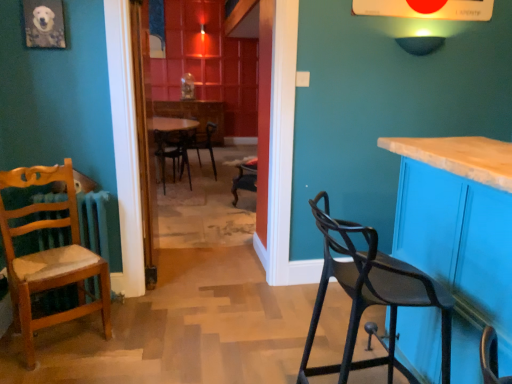
What is the approximate width of wooden table at center?

wooden table at center is 15.55 inches wide.

The height and width of the screenshot is (384, 512). In order to click on wooden table at center in this screenshot , I will do `click(196, 116)`.

The width and height of the screenshot is (512, 384). Find the location of `metallic black chair at center, the 2th chair from the right`. metallic black chair at center, the 2th chair from the right is located at coordinates (203, 144).

Describe the element at coordinates (460, 235) in the screenshot. The height and width of the screenshot is (384, 512). I see `matte wood cabinet at right` at that location.

This screenshot has height=384, width=512. Find the location of `wooden chair with cushion at left, positioned as the second chair in front-to-back order`. wooden chair with cushion at left, positioned as the second chair in front-to-back order is located at coordinates (50, 256).

You are a GUI agent. You are given a task and a screenshot of the screen. Output one action in this format:
    pyautogui.click(x=<x>, y=<y>)
    Task: Click on the black matte bar stool at right, the fourth chair positioned from the left
    Image resolution: width=512 pixels, height=384 pixels.
    Given the screenshot: What is the action you would take?
    coord(371,293)

Can you confirm if wooden radiator at left is bigger than metallic black chair at center, which is counted as the third chair, starting from the left?

Actually, wooden radiator at left might be smaller than metallic black chair at center, which is counted as the third chair, starting from the left.

Is wooden radiator at left to the right of metallic black chair at center, acting as the 4th chair starting from the front, from the viewer's perspective?

No, wooden radiator at left is not to the right of metallic black chair at center, acting as the 4th chair starting from the front.

In the scene shown: Is wooden radiator at left spatially inside metallic black chair at center, which is counted as the third chair, starting from the left, or outside of it?

wooden radiator at left is not enclosed by metallic black chair at center, which is counted as the third chair, starting from the left.

Locate an element on the screen. radiator on the left of metallic black chair at center, the 2th chair from the right is located at coordinates [x=94, y=222].

Choose the correct answer: Is wooden chair with cushion at left, positioned as the fourth chair in right-to-left order, inside metallic black chair at center, the first chair in the back-to-front sequence, or outside it?

The correct answer is: outside.

Image resolution: width=512 pixels, height=384 pixels. I want to click on the 2nd chair positioned below the metallic black chair at center, the first chair in the back-to-front sequence (from the image's perspective), so click(x=50, y=256).

From a real-world perspective, does wooden chair with cushion at left, positioned as the fourth chair in right-to-left order, stand above metallic black chair at center, the first chair in the back-to-front sequence?

Indeed, from a real-world perspective, wooden chair with cushion at left, positioned as the fourth chair in right-to-left order, stands above metallic black chair at center, the first chair in the back-to-front sequence.

Based on the photo, could you tell me if wooden chair with cushion at left, positioned as the fourth chair in right-to-left order, is turned towards metallic black chair at center, the first chair in the back-to-front sequence?

No, wooden chair with cushion at left, positioned as the fourth chair in right-to-left order, is not turned towards metallic black chair at center, the first chair in the back-to-front sequence.

From a real-world perspective, between wooden radiator at left and wooden chair with cushion at left, the 1th chair positioned from the left, who is vertically lower?

In real-world perspective, wooden radiator at left is lower.

Find the location of a particular element. radiator behind the wooden chair with cushion at left, positioned as the second chair in front-to-back order is located at coordinates point(94,222).

Which is less distant, (85, 286) or (31, 183)?

The point (31, 183) is in front.

In the scene shown: Between wooden chair with cushion at left, the 1th chair positioned from the left, and wooden table at center, which one has larger size?

wooden table at center.

Is wooden chair with cushion at left, positioned as the fourth chair in right-to-left order, in front of or behind wooden table at center in the image?

In the image, wooden chair with cushion at left, positioned as the fourth chair in right-to-left order, appears in front of wooden table at center.

Is wooden chair with cushion at left, positioned as the second chair in front-to-back order, oriented towards wooden table at center?

No, wooden chair with cushion at left, positioned as the second chair in front-to-back order, is not facing towards wooden table at center.

Which is more to the right, wooden chair with cushion at left, positioned as the second chair in front-to-back order, or wooden table at center?

wooden chair with cushion at left, positioned as the second chair in front-to-back order.

Would you say black matte bar stool at right, which is the first chair from front to back, is to the left or to the right of wooden table at center in the picture?

Clearly, black matte bar stool at right, which is the first chair from front to back, is on the right of wooden table at center in the image.

From the picture: What's the angular difference between black matte bar stool at right, which appears as the fourth chair when viewed from the back, and wooden table at center's facing directions?

89 degrees.

From the image's perspective, does black matte bar stool at right, the fourth chair positioned from the left, appear higher than wooden table at center?

No.

Does black matte bar stool at right, which is the first chair from front to back, have a greater height compared to wooden table at center?

In fact, black matte bar stool at right, which is the first chair from front to back, may be shorter than wooden table at center.

In the scene shown: Is wooden table at center next to wooden door at center?

No, wooden table at center is not making contact with wooden door at center.

From a real-world perspective, between wooden table at center and wooden door at center, who is vertically higher?

wooden door at center.

Between wooden table at center and wooden door at center, which one has more height?

wooden door at center.

Which point is more distant from viewer, (234, 82) or (155, 212)?

The point (234, 82) is more distant.

Can you confirm if metallic black chair at center, the first chair in the back-to-front sequence, is shorter than wooden table at center?

Indeed, metallic black chair at center, the first chair in the back-to-front sequence, has a lesser height compared to wooden table at center.

Between metallic black chair at center, acting as the 4th chair starting from the front, and wooden table at center, which one appears on the left side from the viewer's perspective?

wooden table at center is more to the left.

From a real-world perspective, which object stands above the other?

wooden table at center is physically above.

Can you confirm if metallic black chair at center, the first chair in the back-to-front sequence, is smaller than wooden table at center?

Incorrect, metallic black chair at center, the first chair in the back-to-front sequence, is not smaller in size than wooden table at center.

There is a wooden radiator at left. Identify the location of the 2nd chair above it (from the image's perspective). This screenshot has width=512, height=384. (203, 144).

The height and width of the screenshot is (384, 512). There is a metallic black chair at center, the 2th chair from the right. What are the coordinates of `the 2nd chair above it (from a real-world perspective)` in the screenshot? It's located at (50, 256).

Which object lies nearer to the anchor point black matte chair at center, arranged as the 3th chair when viewed from the right, matte wood cabinet at right or wooden radiator at left?

wooden radiator at left lies closer to black matte chair at center, arranged as the 3th chair when viewed from the right, than the other object.

Considering their positions, is wooden radiator at left positioned closer to matte wood cabinet at right than wooden table at center?

wooden radiator at left is positioned closer to the anchor matte wood cabinet at right.

From the image, which object appears to be nearer to wooden door at center, wooden chair with cushion at left, positioned as the second chair in front-to-back order, or black matte bar stool at right, the fourth chair positioned from the left?

wooden chair with cushion at left, positioned as the second chair in front-to-back order.

From the image, which object appears to be farther from black matte bar stool at right, which appears as the fourth chair when viewed from the back, wooden table at center or black matte chair at center, placed as the 2th chair when sorted from left to right?

wooden table at center is further to black matte bar stool at right, which appears as the fourth chair when viewed from the back.

Which object lies further to the anchor point black matte chair at center, placed as the 2th chair when sorted from back to front, wooden door at center or matte wood cabinet at right?

Based on the image, matte wood cabinet at right appears to be further to black matte chair at center, placed as the 2th chair when sorted from back to front.

When comparing their distances from metallic black chair at center, which is counted as the third chair, starting from the left, does wooden chair with cushion at left, positioned as the second chair in front-to-back order, or wooden table at center seem closer?

The object closer to metallic black chair at center, which is counted as the third chair, starting from the left, is wooden table at center.

Looking at the image, which one is located closer to wooden chair with cushion at left, the 1th chair positioned from the left, wooden table at center or wooden door at center?

Based on the image, wooden door at center appears to be nearer to wooden chair with cushion at left, the 1th chair positioned from the left.

Considering their positions, is metallic black chair at center, acting as the 4th chair starting from the front, positioned closer to wooden chair with cushion at left, the 1th chair positioned from the left, than wooden radiator at left?

Based on the image, wooden radiator at left appears to be nearer to wooden chair with cushion at left, the 1th chair positioned from the left.

I want to click on restaurant positioned between wooden chair with cushion at left, the 1th chair positioned from the left, and wooden table at center from near to far, so click(x=247, y=88).

Identify the location of restaurant located between wooden door at center and matte wood cabinet at right in the left-right direction. (247, 88).

Identify the location of radiator between wooden chair with cushion at left, positioned as the fourth chair in right-to-left order, and metallic black chair at center, which is counted as the third chair, starting from the left, in the front-back direction. The image size is (512, 384). (94, 222).

At what (x,y) coordinates should I click in order to perform the action: click on door located between wooden radiator at left and wooden table at center in the left-right direction. Please return your answer as a coordinate pair (x, y). This screenshot has height=384, width=512. Looking at the image, I should click on (144, 134).